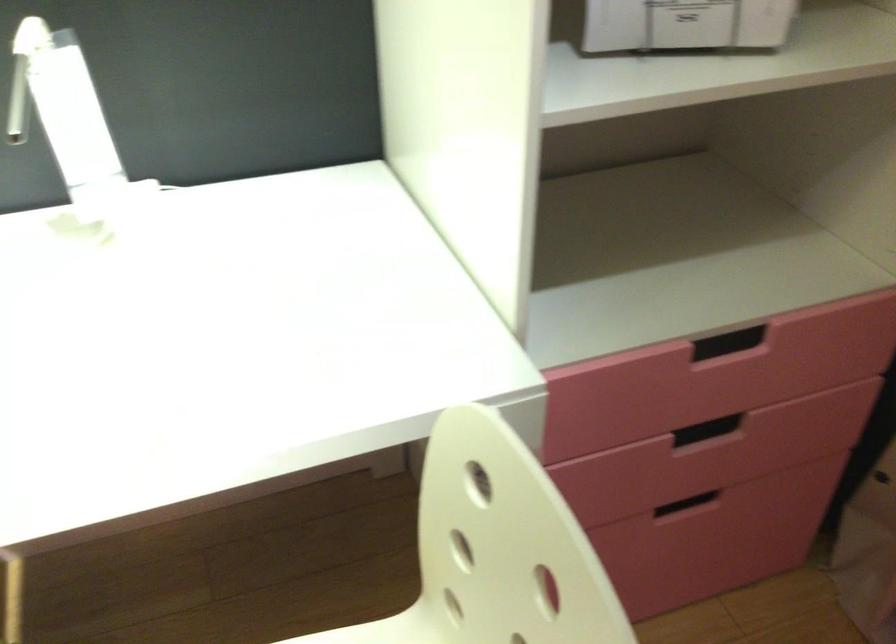
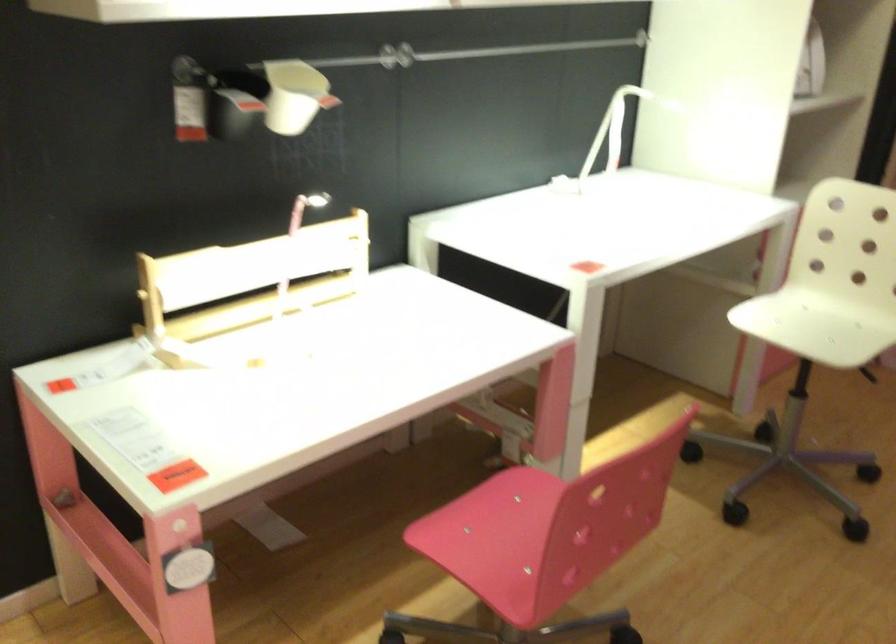
Find the pixel in the second image that matches (x=126, y=113) in the first image.

(618, 126)